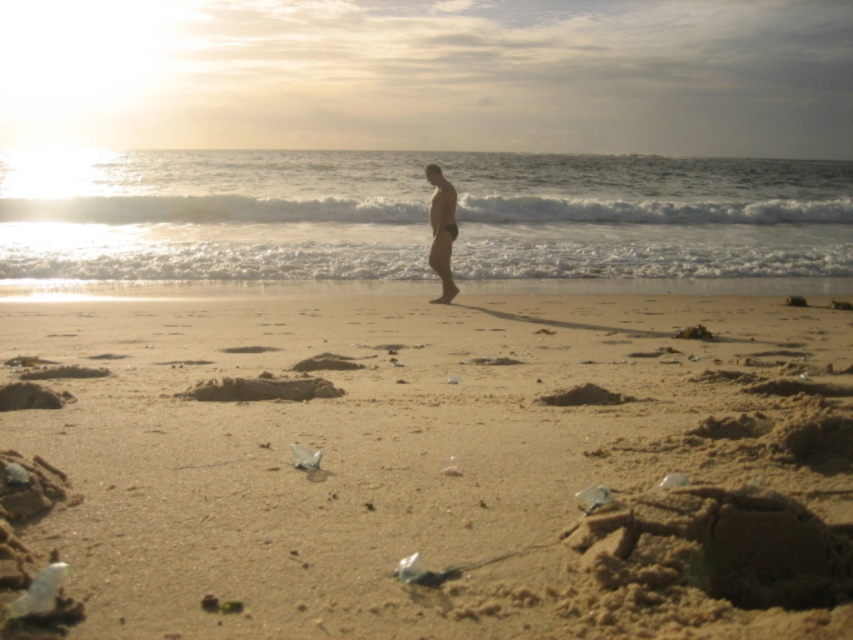
Does brown sandy beach at center appear over matte black swim trunks at center?

Actually, brown sandy beach at center is below matte black swim trunks at center.

Is brown sandy beach at center further to camera compared to matte black swim trunks at center?

No, it is in front of matte black swim trunks at center.

Between point (109, 340) and point (453, 195), which one is positioned behind?

Point (453, 195)

Locate an element on the screen. The width and height of the screenshot is (853, 640). brown sandy beach at center is located at coordinates (448, 467).